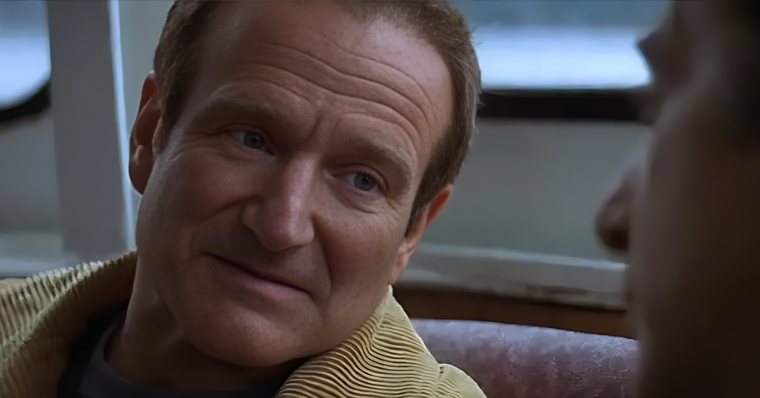
Locate an element on the screen. The height and width of the screenshot is (398, 760). window border is located at coordinates tap(521, 105), tap(23, 109).